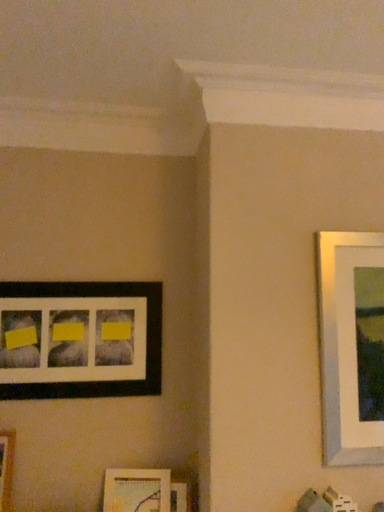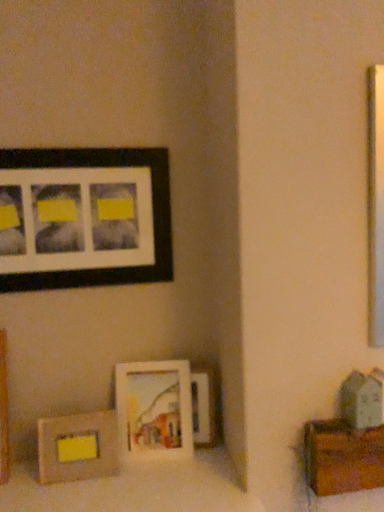
Question: Which way did the camera rotate in the video?

Choices:
 (A) rotated upward
 (B) rotated downward

Answer: (B)